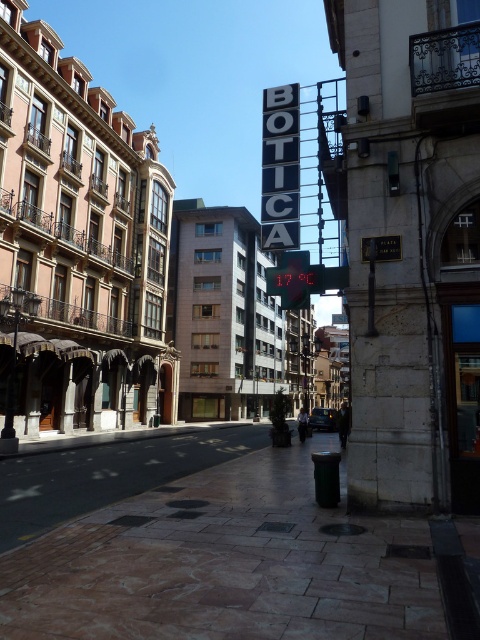
Question: Is brown stone pavement at lower center to the left of black metal sign at upper center from the viewer's perspective?

Choices:
 (A) yes
 (B) no

Answer: (A)

Question: Among these points, which one is nearest to the camera?

Choices:
 (A) (291, 161)
 (B) (265, 512)

Answer: (B)

Question: Is brown stone pavement at lower center below black metal sign at upper center?

Choices:
 (A) no
 (B) yes

Answer: (B)

Question: Can you confirm if brown stone pavement at lower center is bigger than black metal sign at upper center?

Choices:
 (A) no
 (B) yes

Answer: (A)